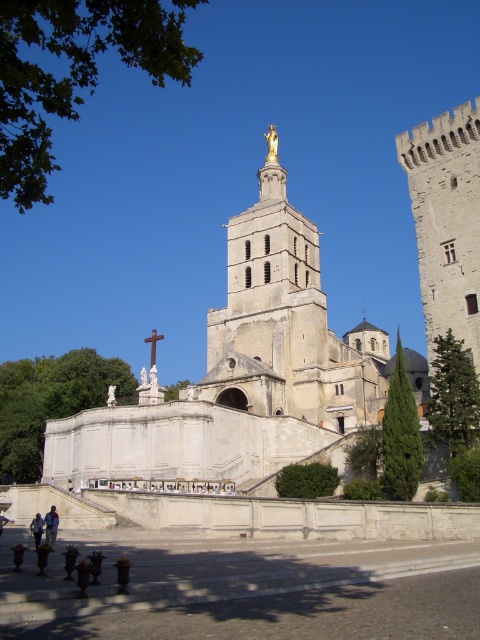
Question: Does light blue fabric jacket at lower left lie in front of dark blue jeans at lower left?

Choices:
 (A) no
 (B) yes

Answer: (A)

Question: Among these objects, which one is farthest from the camera?

Choices:
 (A) gray stone tower at right
 (B) dark blue jeans at lower left

Answer: (A)

Question: Is gray stone tower at right smaller than dark brown leather shoes at lower left?

Choices:
 (A) yes
 (B) no

Answer: (B)

Question: Which point is closer to the camera taking this photo?

Choices:
 (A) (154, 337)
 (B) (0, 522)
 (C) (52, 534)

Answer: (C)

Question: Is gray stone tower at right smaller than dark blue jeans at lower left?

Choices:
 (A) no
 (B) yes

Answer: (A)

Question: Which point is closer to the camera?

Choices:
 (A) (48, 536)
 (B) (1, 528)
 (C) (443, 224)

Answer: (A)